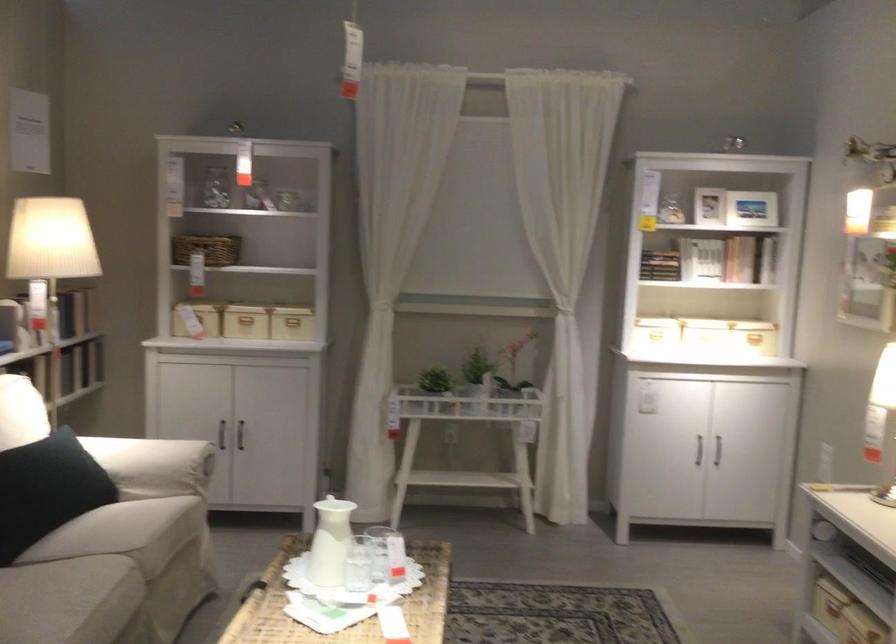
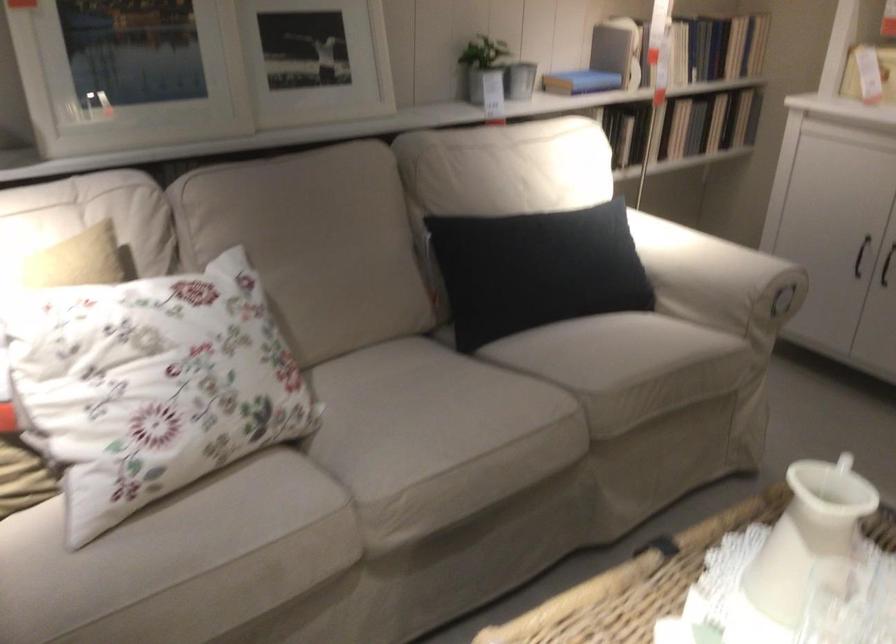
The point at (x=168, y=468) is marked in the first image. Where is the corresponding point in the second image?

(717, 279)